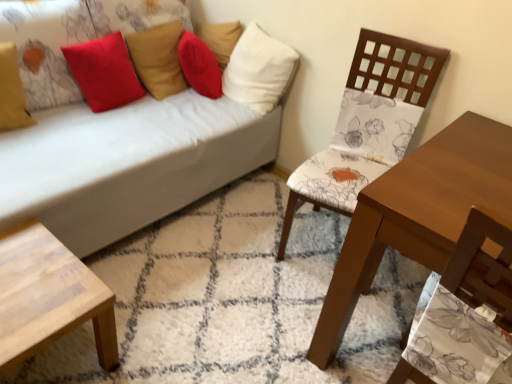
Locate an element on the screen. The image size is (512, 384). free space above light wood/texture coffee table at lower left (from a real-world perspective) is located at coordinates (31, 278).